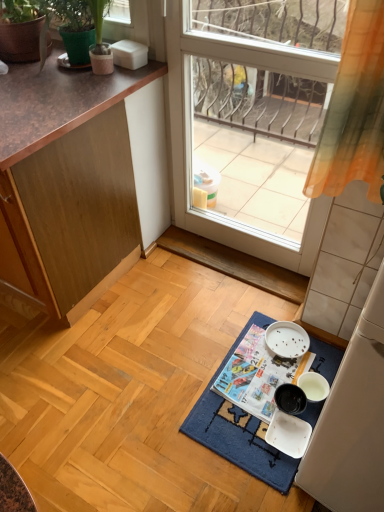
Image resolution: width=384 pixels, height=512 pixels. In order to click on vacant area in front of green textured pot at upper left in this screenshot , I will do `click(56, 90)`.